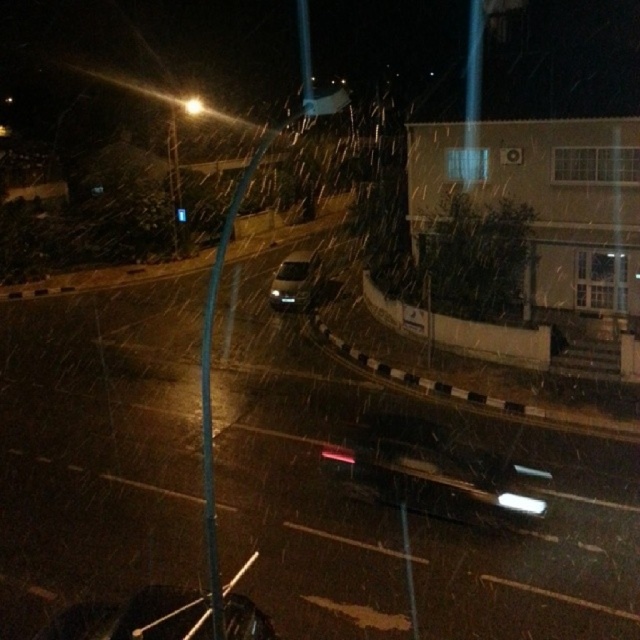
Does metallic pole at left have a larger size compared to sleek silver sedan at center?

Yes, metallic pole at left is bigger than sleek silver sedan at center.

Can you confirm if metallic pole at left is thinner than sleek silver sedan at center?

Incorrect, metallic pole at left's width is not less than sleek silver sedan at center's.

Describe the element at coordinates (211, 324) in the screenshot. I see `metallic pole at left` at that location.

You are a GUI agent. You are given a task and a screenshot of the screen. Output one action in this format:
    pyautogui.click(x=<x>, y=<y>)
    Task: Click on the metallic pole at left
    The image size is (640, 640).
    Given the screenshot: What is the action you would take?
    pyautogui.click(x=211, y=324)

Where is `sleek silver sedan at center`? Image resolution: width=640 pixels, height=640 pixels. sleek silver sedan at center is located at coordinates (296, 282).

Does sleek silver sedan at center have a larger size compared to blue glass traffic light at upper center?

Correct, sleek silver sedan at center is larger in size than blue glass traffic light at upper center.

I want to click on sleek silver sedan at center, so click(296, 282).

Where is `sleek silver sedan at center`? The width and height of the screenshot is (640, 640). sleek silver sedan at center is located at coordinates (296, 282).

Looking at this image, which is below, metallic pole at left or blue glass traffic light at upper center?

blue glass traffic light at upper center

Is metallic pole at left behind blue glass traffic light at upper center?

No.

You are a GUI agent. You are given a task and a screenshot of the screen. Output one action in this format:
    pyautogui.click(x=<x>, y=<y>)
    Task: Click on the metallic pole at left
    The image size is (640, 640).
    Given the screenshot: What is the action you would take?
    pyautogui.click(x=211, y=324)

You are a GUI agent. You are given a task and a screenshot of the screen. Output one action in this format:
    pyautogui.click(x=<x>, y=<y>)
    Task: Click on the metallic pole at left
    The height and width of the screenshot is (640, 640).
    Given the screenshot: What is the action you would take?
    pyautogui.click(x=211, y=324)